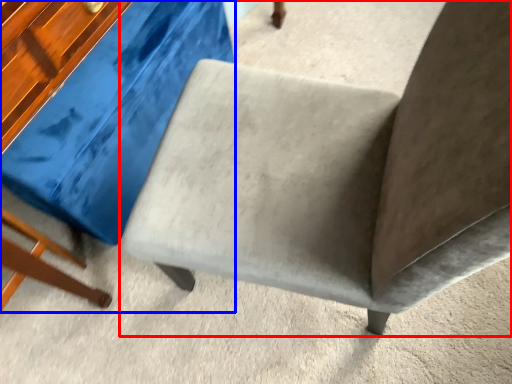
Question: Which of the following is the closest to the observer, chair (highlighted by a red box) or swivel chair (highlighted by a blue box)?

Choices:
 (A) chair
 (B) swivel chair

Answer: (A)